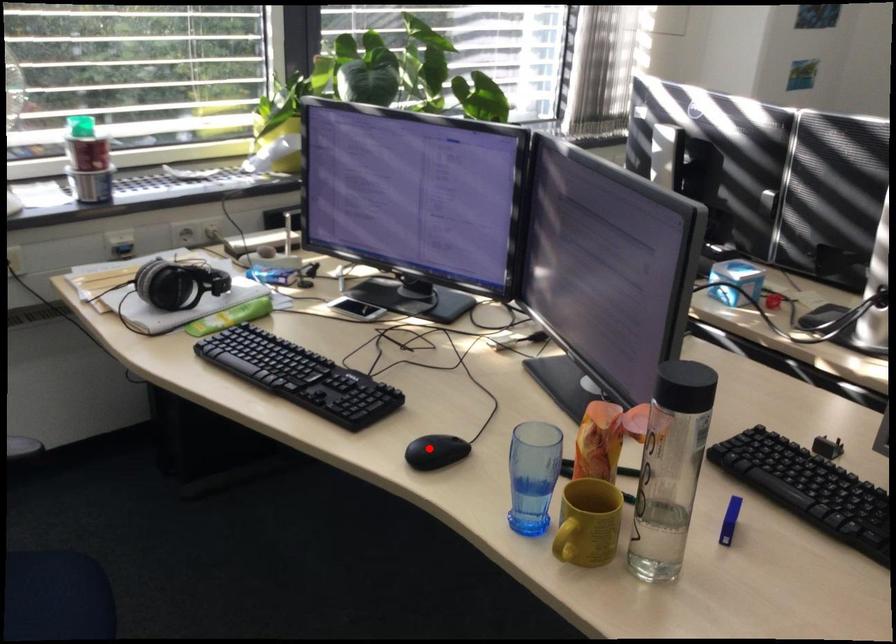
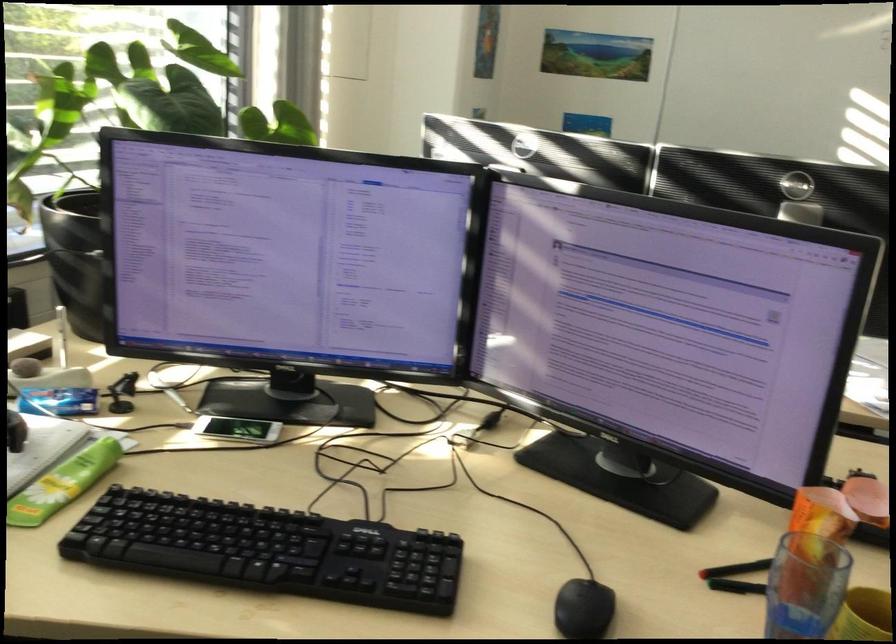
Question: I am providing you with two images of the same scene from different viewpoints. Given a red point in image1, look at the same physical point in image2. Is it:

Choices:
 (A) Closer to the viewpoint
 (B) Farther from the viewpoint

Answer: (A)